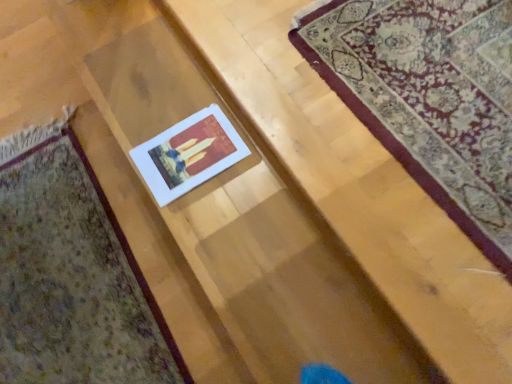
The height and width of the screenshot is (384, 512). I want to click on matte paper card at center, so click(x=72, y=276).

Find the location of a particular element. The height and width of the screenshot is (384, 512). white paper at center is located at coordinates (189, 154).

Between white paper at center and white paper at center, which one appears on the left side from the viewer's perspective?

white paper at center is more to the left.

Which point is more forward, (241, 145) or (145, 24)?

The point (241, 145) is more forward.

From the image's perspective, is white paper at center above white paper at center?

A: No, from the image's perspective, white paper at center is not above white paper at center.

Measure the distance from matte paper card at center to white paper at center.

The distance of matte paper card at center from white paper at center is 15.96 inches.

Locate an element on the screen. This screenshot has width=512, height=384. mat directly beneath the white paper at center (from a real-world perspective) is located at coordinates (72, 276).

Are matte paper card at center and white paper at center making contact?

No, matte paper card at center is not in contact with white paper at center.

From the image's perspective, is matte paper card at center on top of white paper at center?

No.

You are a GUI agent. You are given a task and a screenshot of the screen. Output one action in this format:
    pyautogui.click(x=<x>, y=<y>)
    Task: Click on the stairwell that appears in front of the matte paper card at center
    This screenshot has width=512, height=384.
    Given the screenshot: What is the action you would take?
    pyautogui.click(x=246, y=218)

Between white paper at center and matte paper card at center, which one appears on the left side from the viewer's perspective?

matte paper card at center is more to the left.

Looking at this image, how much distance is there between white paper at center and matte paper card at center?

white paper at center is 15.77 inches from matte paper card at center.

Is white paper at center looking in the opposite direction of matte paper card at center?

No, matte paper card at center is not at the back of white paper at center.

Is white paper at center next to white paper at center?

No, white paper at center is not making contact with white paper at center.

Is white paper at center positioned beyond the bounds of white paper at center?

Yes.

From a real-world perspective, relative to white paper at center, is white paper at center vertically above or below?

white paper at center is situated higher than white paper at center in the real world.

Considering the sizes of matte paper card at center and white paper at center in the image, is matte paper card at center taller or shorter than white paper at center?

matte paper card at center is shorter than white paper at center.

Considering the positions of objects matte paper card at center and white paper at center in the image provided, who is more to the left, matte paper card at center or white paper at center?

matte paper card at center is more to the left.

Is matte paper card at center facing away from white paper at center?

No.

Which is more to the right, white paper at center or matte paper card at center?

white paper at center.

Is matte paper card at center inside white paper at center?

No, matte paper card at center is not a part of white paper at center.

Could you tell me if white paper at center is turned towards matte paper card at center?

No.

Who is bigger, white paper at center or matte paper card at center?

matte paper card at center is bigger.

Find the location of `stairwell on the right of the white paper at center`. stairwell on the right of the white paper at center is located at coordinates (246, 218).

Image resolution: width=512 pixels, height=384 pixels. I want to click on mat beneath the white paper at center (from a real-world perspective), so click(x=72, y=276).

When comparing their distances from matte paper card at center, does white paper at center or white paper at center seem closer?

The object closer to matte paper card at center is white paper at center.

Considering their positions, is matte paper card at center positioned further to white paper at center than white paper at center?

Based on the image, matte paper card at center appears to be further to white paper at center.

Looking at the image, which one is located closer to white paper at center, matte paper card at center or white paper at center?

Among the two, white paper at center is located nearer to white paper at center.

From the image, which object appears to be farther from white paper at center, white paper at center or matte paper card at center?

matte paper card at center is further to white paper at center.

Based on their spatial positions, is white paper at center or white paper at center closer to matte paper card at center?

white paper at center lies closer to matte paper card at center than the other object.

Which object lies nearer to the anchor point white paper at center, white paper at center or matte paper card at center?

white paper at center is closer to white paper at center.

The image size is (512, 384). Find the location of `picture frame located between matte paper card at center and white paper at center in the left-right direction`. picture frame located between matte paper card at center and white paper at center in the left-right direction is located at coordinates (189, 154).